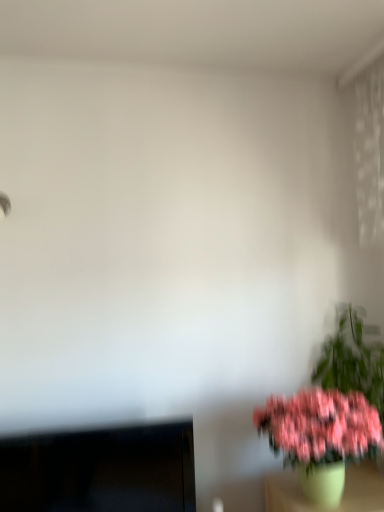
Question: Is black glossy monitor at lower left wider than pink matte flower pot at lower right?

Choices:
 (A) yes
 (B) no

Answer: (B)

Question: Can you confirm if black glossy monitor at lower left is bigger than pink matte flower pot at lower right?

Choices:
 (A) no
 (B) yes

Answer: (B)

Question: Is black glossy monitor at lower left beside pink matte flower pot at lower right?

Choices:
 (A) yes
 (B) no

Answer: (B)

Question: From a real-world perspective, does black glossy monitor at lower left sit lower than pink matte flower pot at lower right?

Choices:
 (A) no
 (B) yes

Answer: (B)

Question: Considering the relative sizes of black glossy monitor at lower left and pink matte flower pot at lower right in the image provided, is black glossy monitor at lower left thinner than pink matte flower pot at lower right?

Choices:
 (A) yes
 (B) no

Answer: (A)

Question: Is black glossy monitor at lower left smaller than pink matte flower pot at lower right?

Choices:
 (A) yes
 (B) no

Answer: (B)

Question: Can you confirm if pink matte flower pot at lower right is taller than black glossy monitor at lower left?

Choices:
 (A) yes
 (B) no

Answer: (A)

Question: Is pink matte flower pot at lower right shorter than black glossy monitor at lower left?

Choices:
 (A) no
 (B) yes

Answer: (A)

Question: Are pink matte flower pot at lower right and black glossy monitor at lower left beside each other?

Choices:
 (A) yes
 (B) no

Answer: (B)

Question: Can you confirm if pink matte flower pot at lower right is thinner than black glossy monitor at lower left?

Choices:
 (A) yes
 (B) no

Answer: (B)

Question: Is the position of pink matte flower pot at lower right more distant than that of black glossy monitor at lower left?

Choices:
 (A) no
 (B) yes

Answer: (A)

Question: Considering the relative positions of pink matte flower pot at lower right and black glossy monitor at lower left in the image provided, is pink matte flower pot at lower right to the left of black glossy monitor at lower left from the viewer's perspective?

Choices:
 (A) no
 (B) yes

Answer: (A)

Question: Considering the positions of pink matte flower pot at lower right and black glossy monitor at lower left in the image, is pink matte flower pot at lower right wider or thinner than black glossy monitor at lower left?

Choices:
 (A) wide
 (B) thin

Answer: (A)